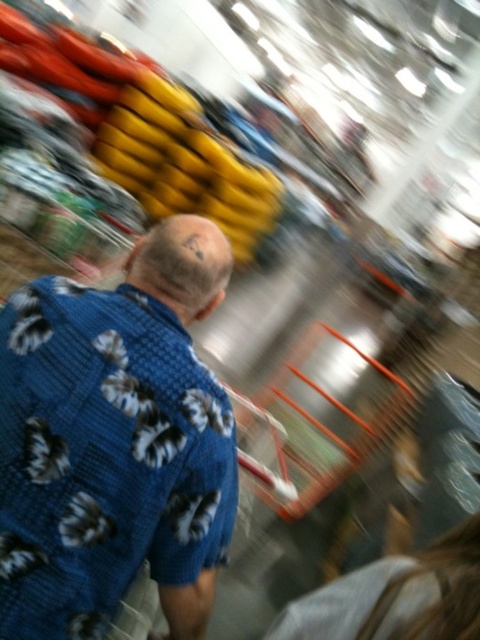
Is the position of blue floral shirt at center less distant than that of blonde hair at lower right?

No, blue floral shirt at center is further to the viewer.

Can you confirm if blue floral shirt at center is thinner than blonde hair at lower right?

No.

Is point (213, 397) in front of point (300, 596)?

Yes, it is in front of point (300, 596).

Locate an element on the screen. Image resolution: width=480 pixels, height=640 pixels. blue floral shirt at center is located at coordinates (115, 442).